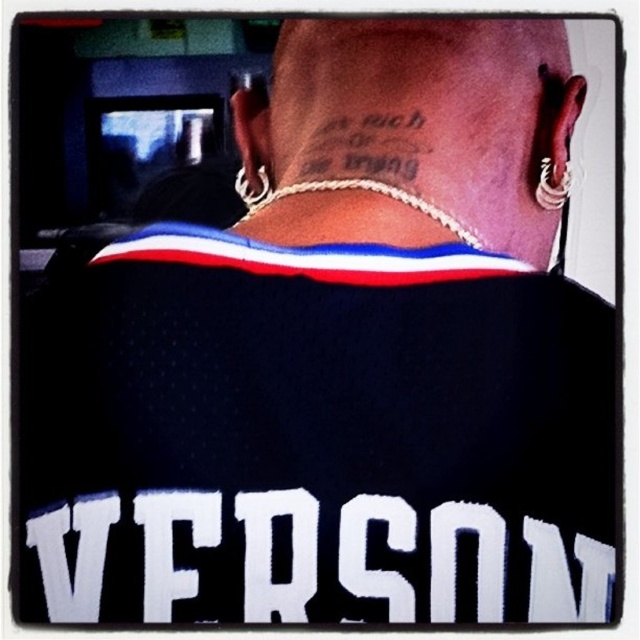
Who is higher up, white fabric jersey at center or black ink tattoo at center?

black ink tattoo at center

Is point (436, 600) more distant than point (337, 161)?

That is False.

Identify the location of white fabric jersey at center. (310, 561).

Find the location of `black skin tattoo at center`. black skin tattoo at center is located at coordinates (412, 131).

Can you confirm if black skin tattoo at center is thinner than black ink tattoo at center?

No.

The image size is (640, 640). Describe the element at coordinates (412, 131) in the screenshot. I see `black skin tattoo at center` at that location.

Locate an element on the screen. black skin tattoo at center is located at coordinates (412, 131).

Is black skin tattoo at center smaller than white fabric jersey at center?

No, black skin tattoo at center is not smaller than white fabric jersey at center.

Is black skin tattoo at center to the left of white fabric jersey at center from the viewer's perspective?

No, black skin tattoo at center is not to the left of white fabric jersey at center.

This screenshot has height=640, width=640. Find the location of `black skin tattoo at center`. black skin tattoo at center is located at coordinates tap(412, 131).

The height and width of the screenshot is (640, 640). I want to click on black skin tattoo at center, so click(x=412, y=131).